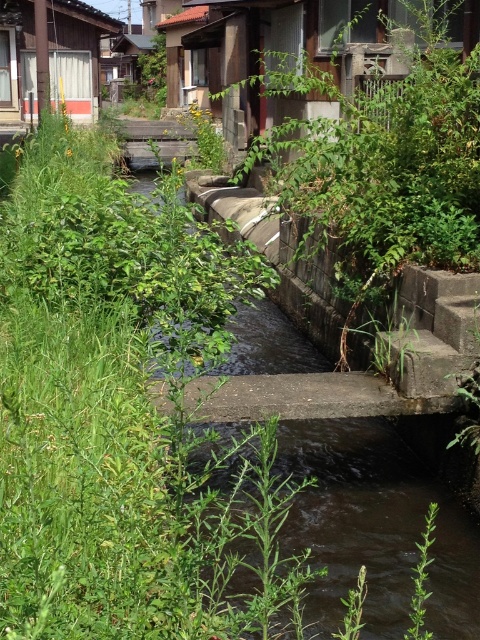
Question: In this image, where is dark brown water at center located relative to green leafy plant at lower right?

Choices:
 (A) below
 (B) above

Answer: (A)

Question: Among these objects, which one is nearest to the camera?

Choices:
 (A) wooden hut at upper center
 (B) green leafy plant at lower right
 (C) dark brown water at center

Answer: (B)

Question: Which point is closer to the camera?

Choices:
 (A) wooden hut at upper center
 (B) wooden hut at upper left
 (C) dark brown water at center

Answer: (C)

Question: Is wooden hut at upper center closer to camera compared to green leafy plant at lower right?

Choices:
 (A) yes
 (B) no

Answer: (B)

Question: Which point appears closest to the camera in this image?

Choices:
 (A) (447, 573)
 (B) (280, 19)
 (C) (23, 36)
 (D) (427, 522)

Answer: (A)

Question: Does dark brown water at center have a smaller size compared to green leafy plant at lower right?

Choices:
 (A) no
 (B) yes

Answer: (B)